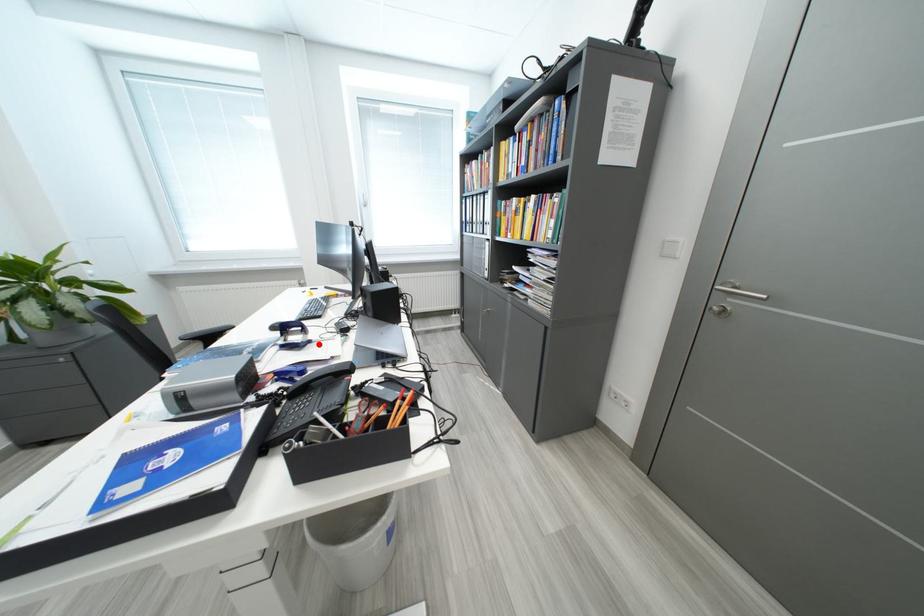
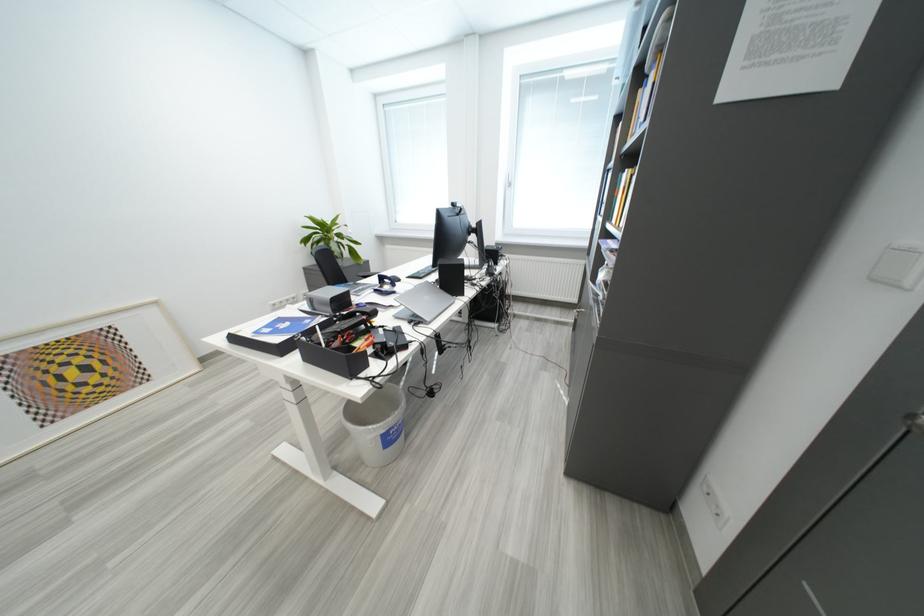
Where in the second image is the point corresponding to the highlighted location from the first image?

(403, 294)